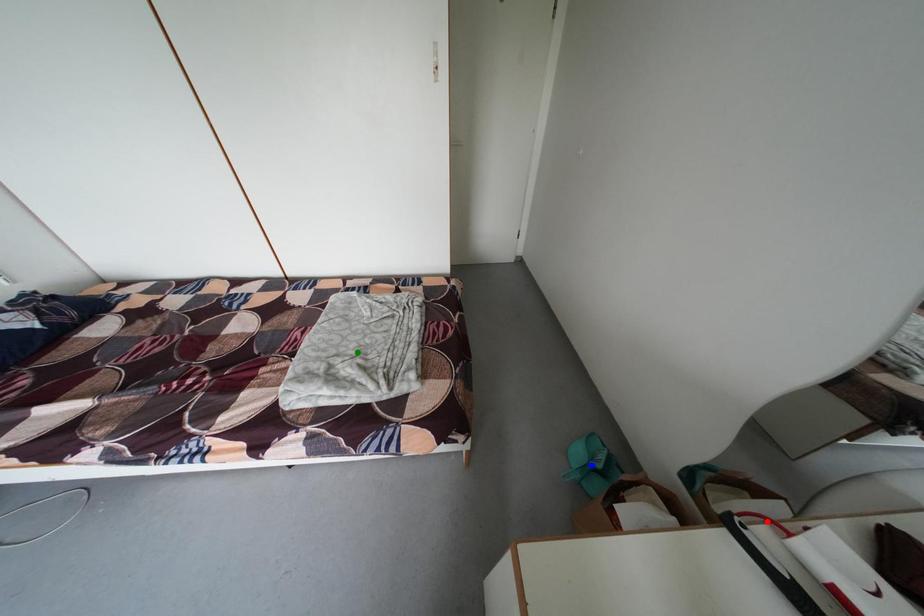
Order these from nearest to farthest:
green point | blue point | red point

1. red point
2. green point
3. blue point